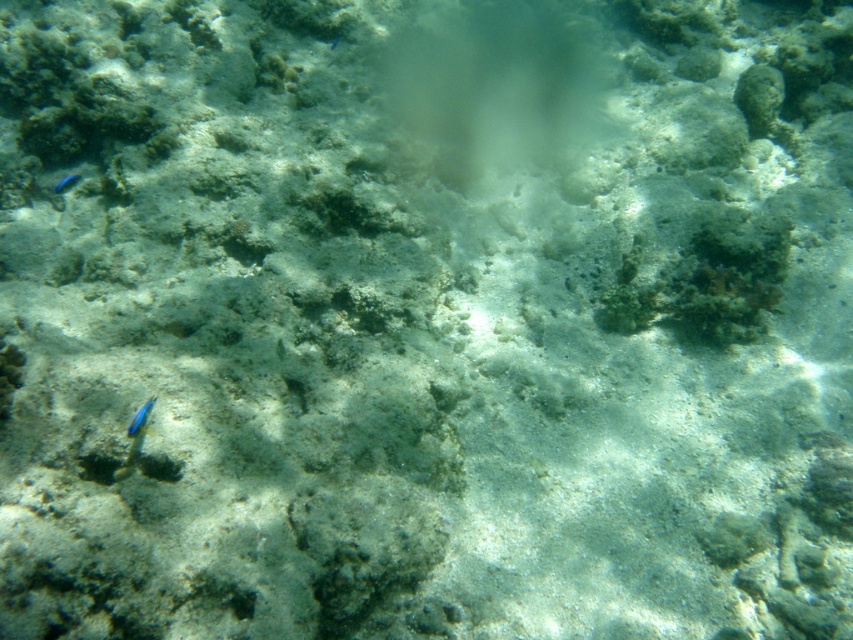
Question: Does blue glossy fish at lower left have a greater width compared to blue glossy fish at upper left?

Choices:
 (A) yes
 (B) no

Answer: (B)

Question: Is blue glossy fish at lower left below blue glossy fish at upper left?

Choices:
 (A) no
 (B) yes

Answer: (B)

Question: Which point appears closest to the camera in this image?

Choices:
 (A) (76, 179)
 (B) (134, 426)

Answer: (B)

Question: Is the position of blue glossy fish at lower left less distant than that of blue glossy fish at upper left?

Choices:
 (A) no
 (B) yes

Answer: (B)

Question: Which object appears closest to the camera in this image?

Choices:
 (A) blue glossy fish at upper left
 (B) blue glossy fish at lower left

Answer: (B)